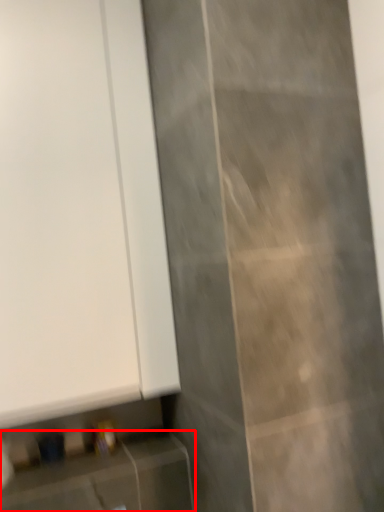
Question: Where is cabinetry (annotated by the red box) located in relation to door in the image?

Choices:
 (A) left
 (B) right

Answer: (B)